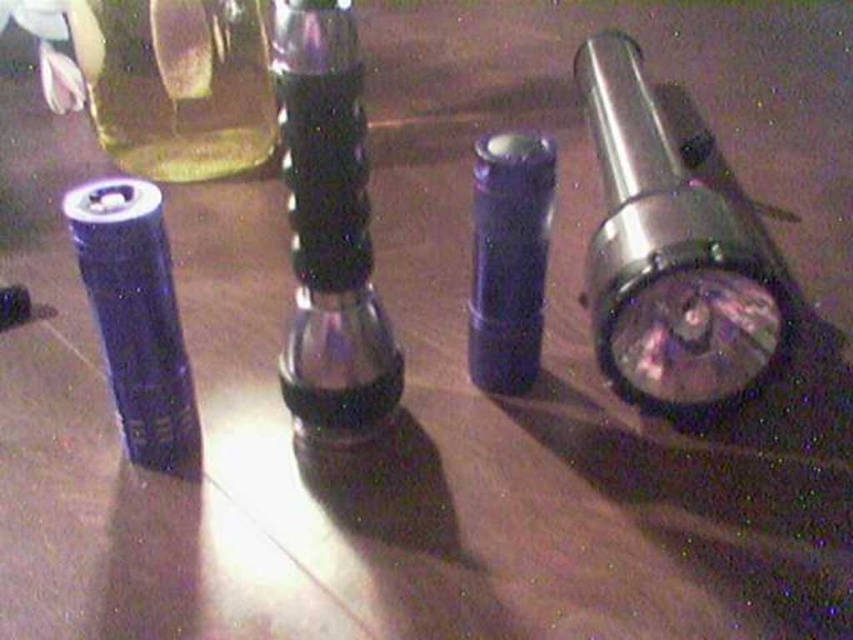
Question: Which point is closer to the camera?

Choices:
 (A) transparent plastic bottle at center
 (B) matte purple lipstick at center
 (C) metallic silver flashlight at right

Answer: (A)

Question: Is the position of transparent plastic bottle at center more distant than that of translucent glass bottle at upper left?

Choices:
 (A) no
 (B) yes

Answer: (A)

Question: Which point is closer to the camera taking this photo?

Choices:
 (A) (682, 362)
 (B) (306, 248)
 (C) (550, 150)

Answer: (B)

Question: Can you confirm if metallic silver flashlight at right is positioned to the left of translucent glass bottle at upper left?

Choices:
 (A) yes
 (B) no

Answer: (B)

Question: Based on their relative distances, which object is nearer to the matte purple lipstick at center?

Choices:
 (A) transparent plastic bottle at center
 (B) metallic silver flashlight at right

Answer: (A)

Question: Can you confirm if metallic silver flashlight at right is wider than matte purple lipstick at center?

Choices:
 (A) yes
 (B) no

Answer: (A)